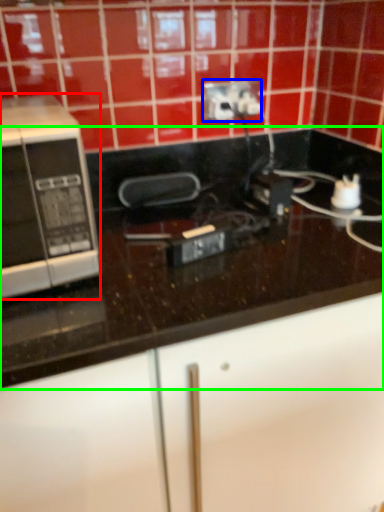
Question: Estimate the real-world distances between objects in this image. Which object is closer to microwave oven (highlighted by a red box), power plugs and sockets (highlighted by a blue box) or countertop (highlighted by a green box)?

Choices:
 (A) power plugs and sockets
 (B) countertop

Answer: (B)